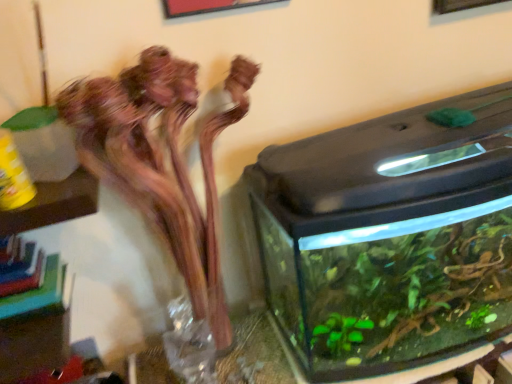
Question: Are transparent glass water tank at right and translucent glass vase at left beside each other?

Choices:
 (A) yes
 (B) no

Answer: (B)

Question: Could you tell me if transparent glass water tank at right is facing translucent glass vase at left?

Choices:
 (A) no
 (B) yes

Answer: (A)

Question: From the image's perspective, is transparent glass water tank at right under translucent glass vase at left?

Choices:
 (A) yes
 (B) no

Answer: (B)

Question: From a real-world perspective, is transparent glass water tank at right on translucent glass vase at left?

Choices:
 (A) yes
 (B) no

Answer: (B)

Question: Does transparent glass water tank at right have a larger size compared to translucent glass vase at left?

Choices:
 (A) no
 (B) yes

Answer: (B)

Question: Considering the relative positions of transparent glass water tank at right and transparent glass vase at center in the image provided, is transparent glass water tank at right to the left or to the right of transparent glass vase at center?

Choices:
 (A) left
 (B) right

Answer: (B)

Question: From a real-world perspective, relative to transparent glass vase at center, is transparent glass water tank at right vertically above or below?

Choices:
 (A) below
 (B) above

Answer: (B)

Question: Is transparent glass water tank at right taller or shorter than transparent glass vase at center?

Choices:
 (A) tall
 (B) short

Answer: (A)

Question: Is transparent glass water tank at right spatially inside transparent glass vase at center, or outside of it?

Choices:
 (A) inside
 (B) outside

Answer: (B)

Question: Does point (357, 236) appear closer or farther from the camera than point (448, 147)?

Choices:
 (A) farther
 (B) closer

Answer: (B)

Question: Considering the relative positions of translucent glass vase at center and transparent glass water tank at right in the image provided, is translucent glass vase at center to the left or to the right of transparent glass water tank at right?

Choices:
 (A) right
 (B) left

Answer: (B)

Question: Is translucent glass vase at center bigger or smaller than transparent glass water tank at right?

Choices:
 (A) big
 (B) small

Answer: (B)

Question: From their relative heights in the image, would you say translucent glass vase at center is taller or shorter than transparent glass water tank at right?

Choices:
 (A) short
 (B) tall

Answer: (A)

Question: Based on their sizes in the image, would you say transparent glass water tank at right is bigger or smaller than translucent glass vase at left?

Choices:
 (A) big
 (B) small

Answer: (A)

Question: From the image's perspective, is transparent glass water tank at right above or below translucent glass vase at left?

Choices:
 (A) above
 (B) below

Answer: (A)